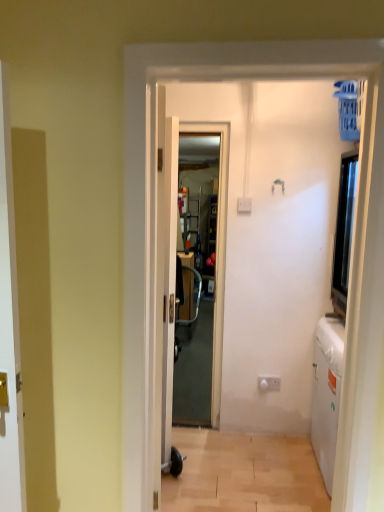
Question: Can you confirm if transparent plastic screen door at center is wider than light brown wood floor at lower center?

Choices:
 (A) yes
 (B) no

Answer: (B)

Question: Is transparent plastic screen door at center turned away from light brown wood floor at lower center?

Choices:
 (A) yes
 (B) no

Answer: (B)

Question: Can you confirm if transparent plastic screen door at center is shorter than light brown wood floor at lower center?

Choices:
 (A) no
 (B) yes

Answer: (A)

Question: Does transparent plastic screen door at center lie behind light brown wood floor at lower center?

Choices:
 (A) yes
 (B) no

Answer: (A)

Question: Is transparent plastic screen door at center at the right side of light brown wood floor at lower center?

Choices:
 (A) no
 (B) yes

Answer: (A)

Question: Is transparent plastic screen door at center touching light brown wood floor at lower center?

Choices:
 (A) yes
 (B) no

Answer: (B)

Question: From the image's perspective, is transparent plastic screen door at center below white glossy door at center?

Choices:
 (A) no
 (B) yes

Answer: (A)

Question: Does transparent plastic screen door at center have a lesser height compared to white glossy door at center?

Choices:
 (A) yes
 (B) no

Answer: (B)

Question: Is transparent plastic screen door at center closer to the viewer compared to white glossy door at center?

Choices:
 (A) yes
 (B) no

Answer: (B)

Question: Can you confirm if transparent plastic screen door at center is smaller than white glossy door at center?

Choices:
 (A) yes
 (B) no

Answer: (A)

Question: Can you confirm if transparent plastic screen door at center is thinner than white glossy door at center?

Choices:
 (A) no
 (B) yes

Answer: (A)

Question: From a real-world perspective, is transparent plastic screen door at center on white glossy door at center?

Choices:
 (A) no
 (B) yes

Answer: (B)

Question: Can we say transparent plastic screen door at center lies outside white glossy electric outlet at lower center?

Choices:
 (A) yes
 (B) no

Answer: (A)